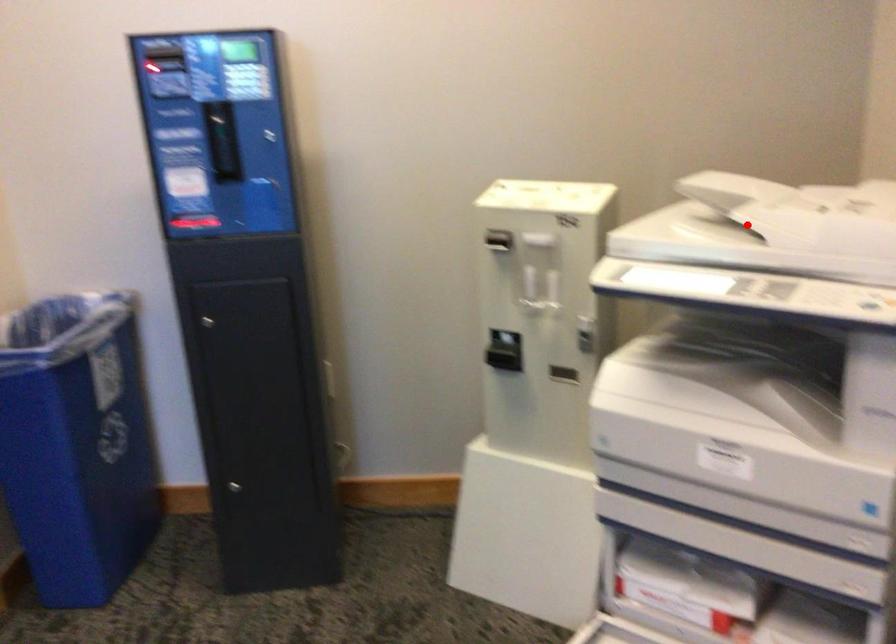
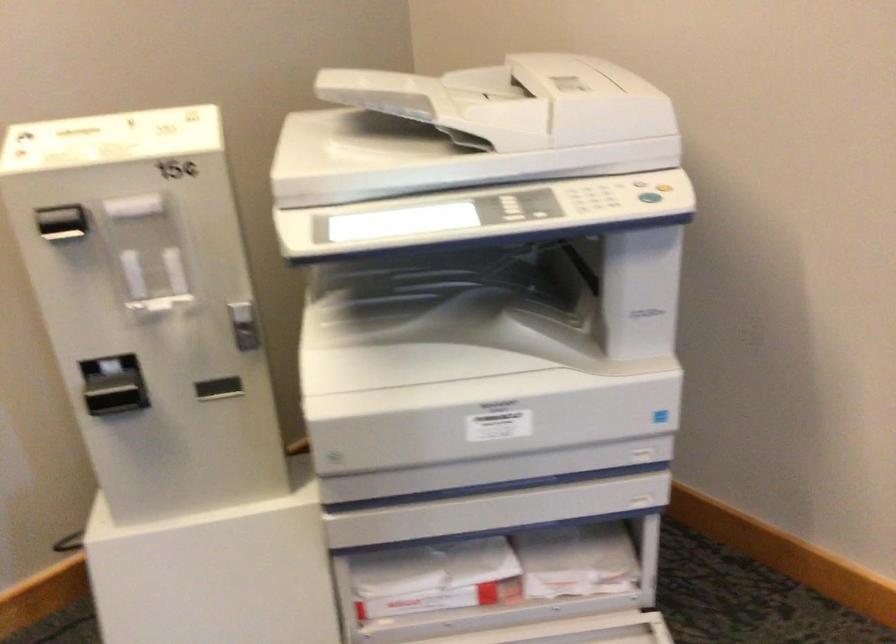
Question: I am providing you with two images of the same scene from different viewpoints. A red point is marked on the first image. Can you still see the location of the red point in image 2?

Choices:
 (A) Yes
 (B) No

Answer: (A)